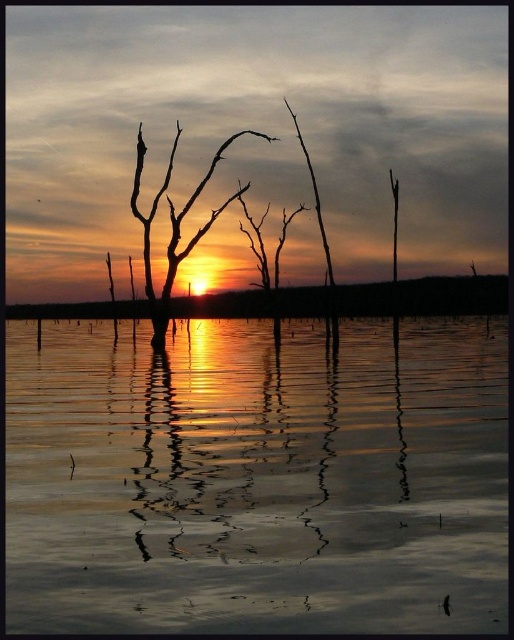
Question: Is smooth reflective water at center above smooth water at center?

Choices:
 (A) yes
 (B) no

Answer: (B)

Question: Does silhouette bare tree at center have a lesser width compared to silhouette wood at center?

Choices:
 (A) no
 (B) yes

Answer: (B)

Question: Among these objects, which one is farthest from the camera?

Choices:
 (A) smooth water at center
 (B) silhouette bare tree at center
 (C) silhouette wood at center
 (D) smooth reflective water at center

Answer: (C)

Question: Is smooth water at center to the right of silhouette bare tree at center from the viewer's perspective?

Choices:
 (A) yes
 (B) no

Answer: (A)

Question: Which point appears closest to the camera in this image?

Choices:
 (A) (289, 108)
 (B) (380, 577)

Answer: (B)

Question: Which point appears closest to the camera in this image?

Choices:
 (A) (458, 600)
 (B) (305, 154)
 (C) (438, 285)
 (D) (207, 225)

Answer: (A)